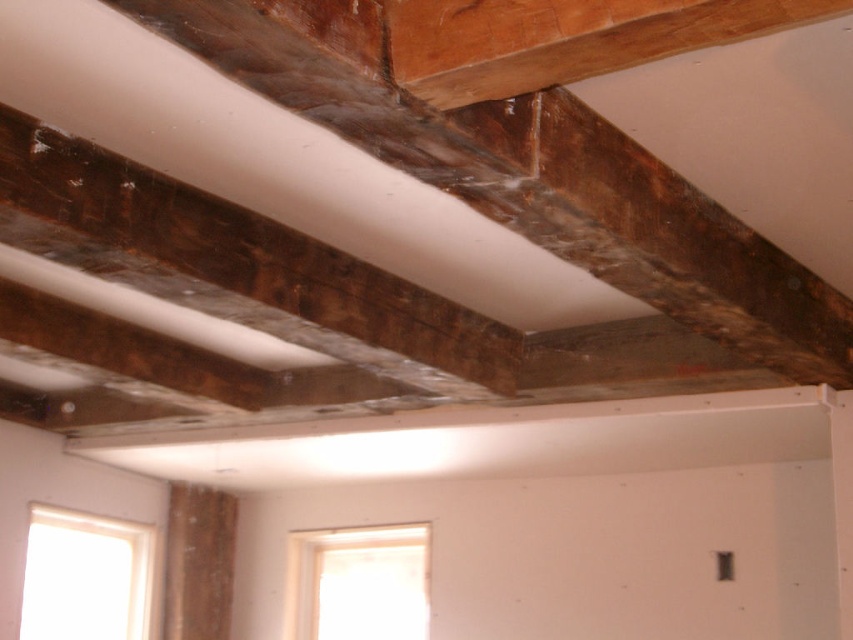
Does dark brown wood beam at upper center appear under dark brown wood at upper center?

No.

Is dark brown wood beam at upper center smaller than dark brown wood at upper center?

No.

In order to click on dark brown wood beam at upper center in this screenshot , I will do `click(538, 180)`.